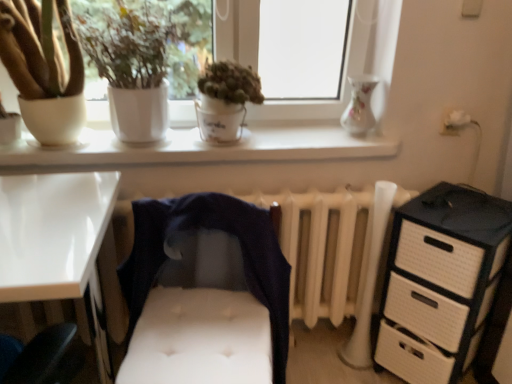
Question: Is matte white pot at left, positioned as the 1th houseplant in left-to-right order, turned away from white glossy window sill at upper center?

Choices:
 (A) yes
 (B) no

Answer: (B)

Question: Is matte white pot at left, the 3th houseplant viewed from the right, positioned in front of white glossy window sill at upper center?

Choices:
 (A) no
 (B) yes

Answer: (B)

Question: From the image's perspective, would you say matte white pot at left, positioned as the 1th houseplant in left-to-right order, is positioned over white glossy window sill at upper center?

Choices:
 (A) yes
 (B) no

Answer: (A)

Question: Is matte white pot at left, the 3th houseplant viewed from the right, positioned far away from white glossy window sill at upper center?

Choices:
 (A) no
 (B) yes

Answer: (A)

Question: From a real-world perspective, is matte white pot at left, positioned as the 1th houseplant in left-to-right order, on top of white glossy window sill at upper center?

Choices:
 (A) no
 (B) yes

Answer: (B)

Question: Could you tell me if matte white pot at left, the 3th houseplant viewed from the right, is turned towards white glossy window sill at upper center?

Choices:
 (A) yes
 (B) no

Answer: (B)

Question: Is white glossy window sill at upper center positioned in front of matte white pot at left, the 3th houseplant viewed from the right?

Choices:
 (A) no
 (B) yes

Answer: (A)

Question: Is the position of white glossy window sill at upper center more distant than that of matte white pot at left, positioned as the 1th houseplant in left-to-right order?

Choices:
 (A) no
 (B) yes

Answer: (B)

Question: From the image's perspective, would you say white glossy window sill at upper center is shown under matte white pot at left, the 3th houseplant viewed from the right?

Choices:
 (A) no
 (B) yes

Answer: (B)

Question: Is white glossy window sill at upper center wider than matte white pot at left, the 3th houseplant viewed from the right?

Choices:
 (A) no
 (B) yes

Answer: (A)

Question: From a real-world perspective, is white glossy window sill at upper center under matte white pot at left, the 3th houseplant viewed from the right?

Choices:
 (A) no
 (B) yes

Answer: (B)

Question: Considering the relative positions of white glossy window sill at upper center and matte white pot at left, positioned as the 1th houseplant in left-to-right order, in the image provided, is white glossy window sill at upper center to the left of matte white pot at left, positioned as the 1th houseplant in left-to-right order, from the viewer's perspective?

Choices:
 (A) no
 (B) yes

Answer: (A)

Question: Is green matte plant at center, acting as the third houseplant starting from the left, touching white glossy desk at lower left?

Choices:
 (A) no
 (B) yes

Answer: (A)